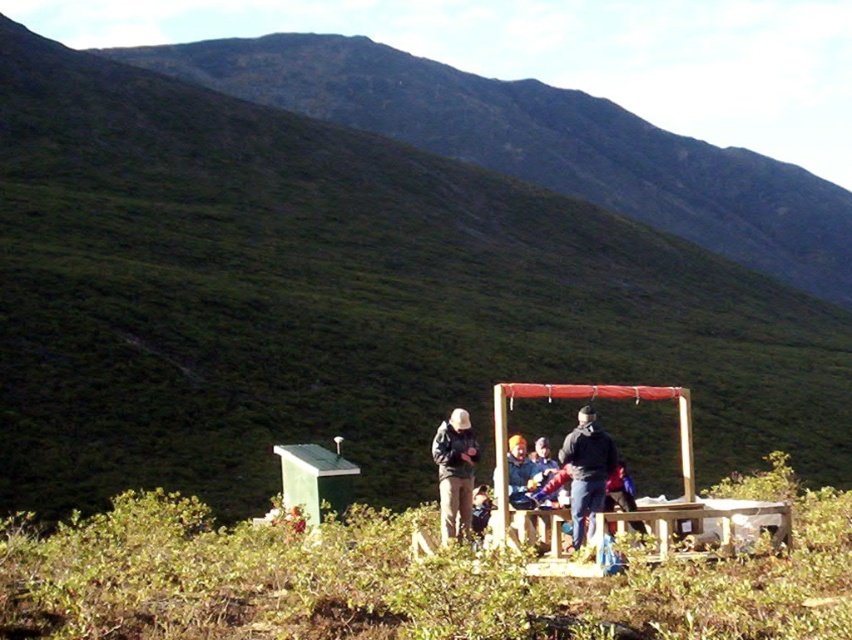
Question: Estimate the real-world distances between objects in this image. Which object is closer to the green grassy hillside at upper left?

Choices:
 (A) wooden picnic table at lower center
 (B) dark blue jacket at center

Answer: (A)

Question: Can you confirm if green grassy hillside at upper left is bigger than green matte hut at lower left?

Choices:
 (A) yes
 (B) no

Answer: (A)

Question: Which point is farther to the camera?

Choices:
 (A) (197, 42)
 (B) (606, 452)
 (C) (302, 461)
 (D) (471, 508)

Answer: (A)

Question: Among these points, which one is farthest from the camera?

Choices:
 (A) (448, 424)
 (B) (301, 460)

Answer: (B)

Question: Is wooden picnic table at lower center bigger than dark brown jacket at center?

Choices:
 (A) yes
 (B) no

Answer: (B)

Question: Is wooden picnic table at lower center thinner than green matte hut at lower left?

Choices:
 (A) no
 (B) yes

Answer: (B)